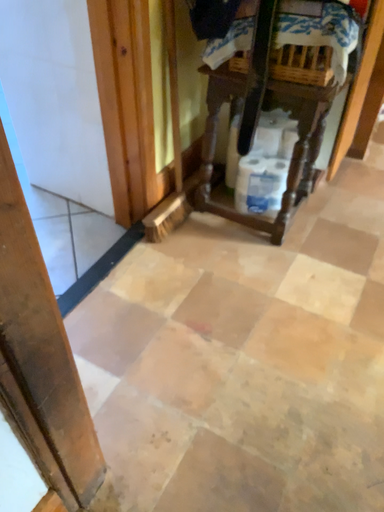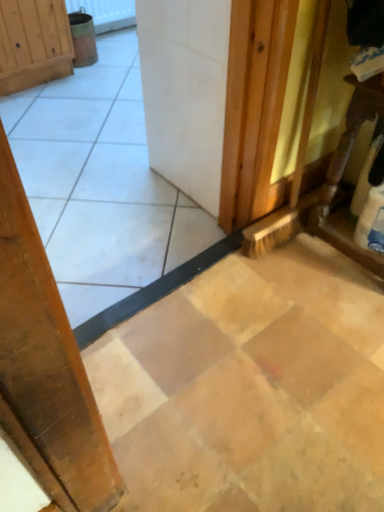
Question: How did the camera likely rotate when shooting the video?

Choices:
 (A) rotated right
 (B) rotated left

Answer: (B)